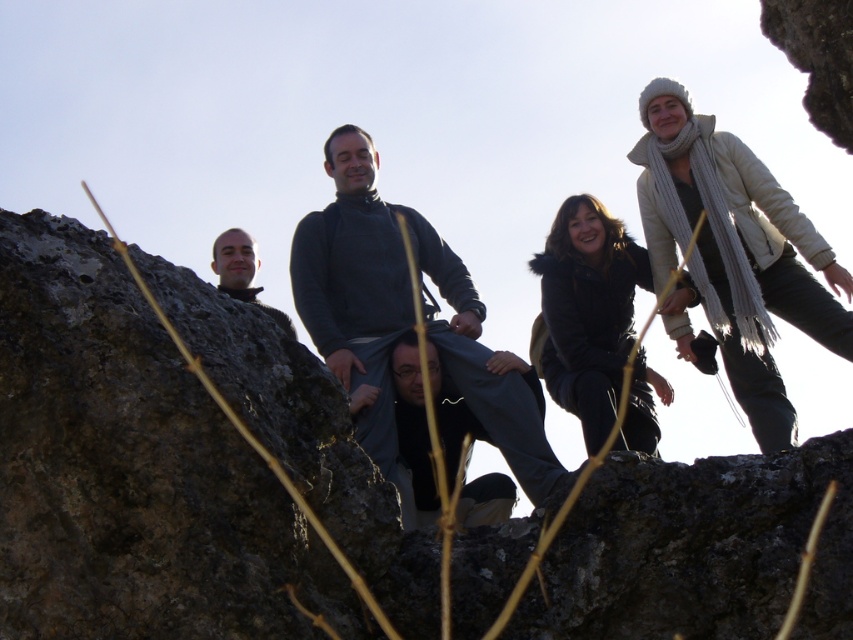
Question: Does dark gray fabric at center have a larger size compared to matte gray sweater at center?

Choices:
 (A) no
 (B) yes

Answer: (A)

Question: Which object is farther from the camera taking this photo?

Choices:
 (A) white knitted hat at upper right
 (B) black fuzzy coat at center
 (C) dark gray fabric at center
 (D) dark gray sweater at center

Answer: (A)

Question: Does dark gray sweater at center have a lesser width compared to dark gray fabric at center?

Choices:
 (A) no
 (B) yes

Answer: (A)

Question: Which of the following is the farthest from the observer?

Choices:
 (A) white knitted hat at upper right
 (B) black fuzzy coat at center
 (C) dark gray sweater at center

Answer: (A)

Question: Which object is closer to the camera taking this photo?

Choices:
 (A) matte gray sweater at center
 (B) dark gray fabric at center
 (C) black fuzzy coat at center
 (D) white knitted hat at upper right

Answer: (A)

Question: Can you confirm if dark gray fabric at center is smaller than matte gray sweater at center?

Choices:
 (A) no
 (B) yes

Answer: (B)